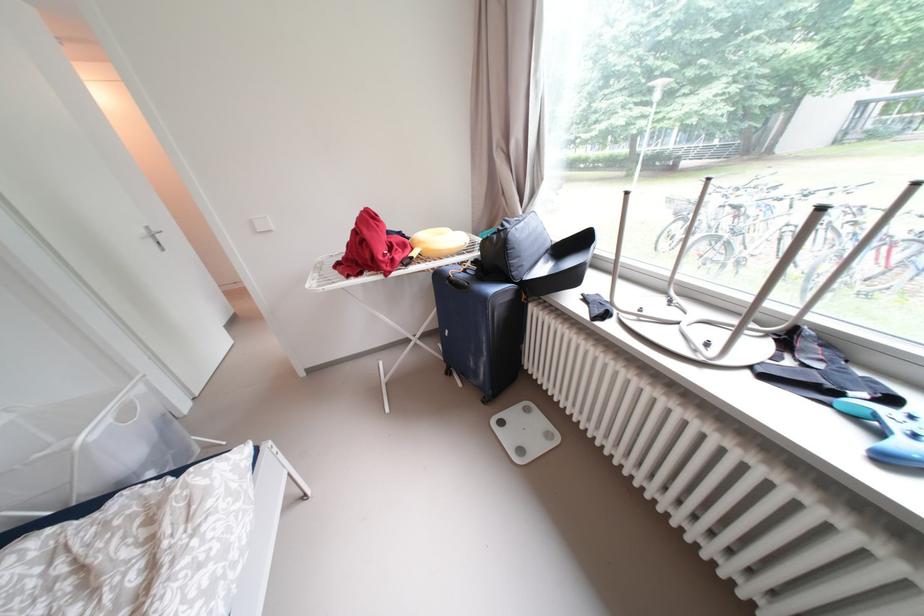
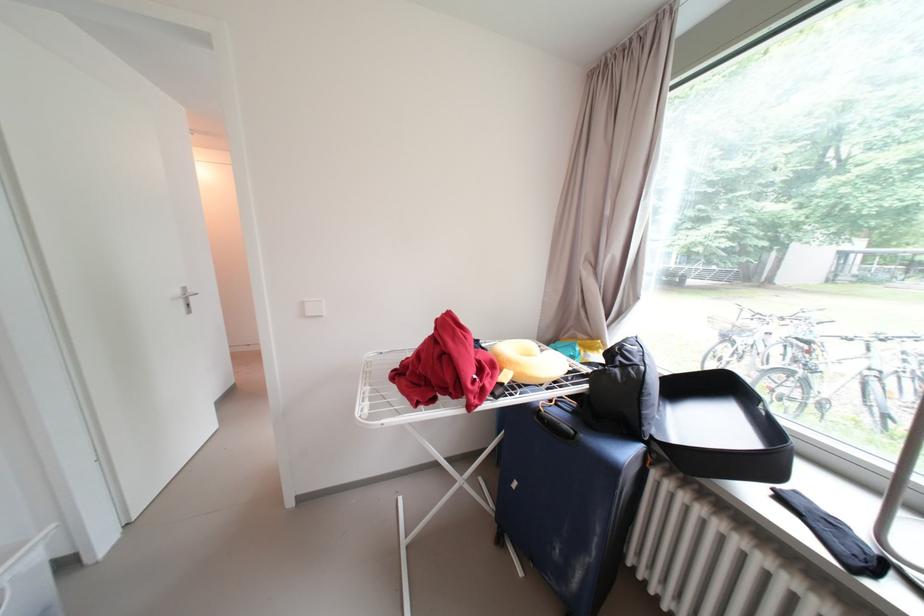
Where in the second image is the point corresponding to the point at 512,233 from the first image?

(640, 371)